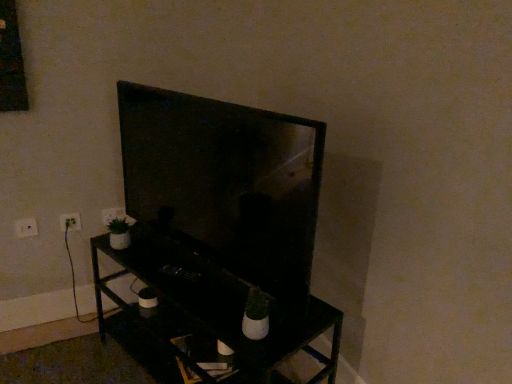
Question: From a real-world perspective, is white plastic electric outlet at lower left, the 3th electric outlet when ordered from back to front, located beneath matte black tv at center?

Choices:
 (A) yes
 (B) no

Answer: (A)

Question: Can you confirm if white plastic electric outlet at lower left, which ranks as the 1th electric outlet in front-to-back order, is thinner than matte black tv at center?

Choices:
 (A) no
 (B) yes

Answer: (B)

Question: Is white plastic electric outlet at lower left, which ranks as the 1th electric outlet in front-to-back order, further to the viewer compared to matte black tv at center?

Choices:
 (A) yes
 (B) no

Answer: (A)

Question: Could you tell me if white plastic electric outlet at lower left, which is counted as the first electric outlet, starting from the left, is turned towards matte black tv at center?

Choices:
 (A) no
 (B) yes

Answer: (A)

Question: Does white plastic electric outlet at lower left, the 3th electric outlet when ordered from back to front, have a larger size compared to matte black tv at center?

Choices:
 (A) yes
 (B) no

Answer: (B)

Question: Is white plastic electric outlet at lower left, which is counted as the first electric outlet, starting from the left, far from matte black tv at center?

Choices:
 (A) yes
 (B) no

Answer: (B)

Question: Is matte black tv at center positioned beyond the bounds of white plastic electric outlet at lower left, which ranks as the first electric outlet in right-to-left order?

Choices:
 (A) no
 (B) yes

Answer: (B)

Question: From a real-world perspective, is matte black tv at center physically above white plastic electric outlet at lower left, marked as the first electric outlet in a back-to-front arrangement?

Choices:
 (A) no
 (B) yes

Answer: (B)

Question: Is matte black tv at center next to white plastic electric outlet at lower left, the 3th electric outlet positioned from the front?

Choices:
 (A) yes
 (B) no

Answer: (B)

Question: Does matte black tv at center come in front of white plastic electric outlet at lower left, the 3th electric outlet positioned from the front?

Choices:
 (A) no
 (B) yes

Answer: (B)

Question: Does matte black tv at center have a lesser width compared to white plastic electric outlet at lower left, the 3th electric outlet positioned from the front?

Choices:
 (A) yes
 (B) no

Answer: (B)

Question: Does matte black tv at center contain white plastic electric outlet at lower left, marked as the first electric outlet in a back-to-front arrangement?

Choices:
 (A) yes
 (B) no

Answer: (B)

Question: Is matte black tv at center in contact with white plastic electric outlet at left, positioned as the second electric outlet in right-to-left order?

Choices:
 (A) no
 (B) yes

Answer: (A)